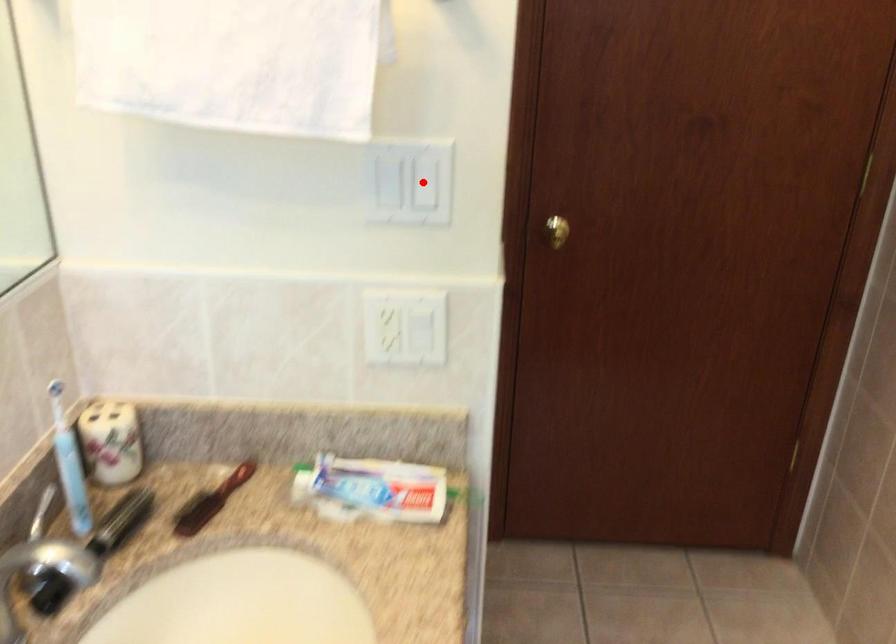
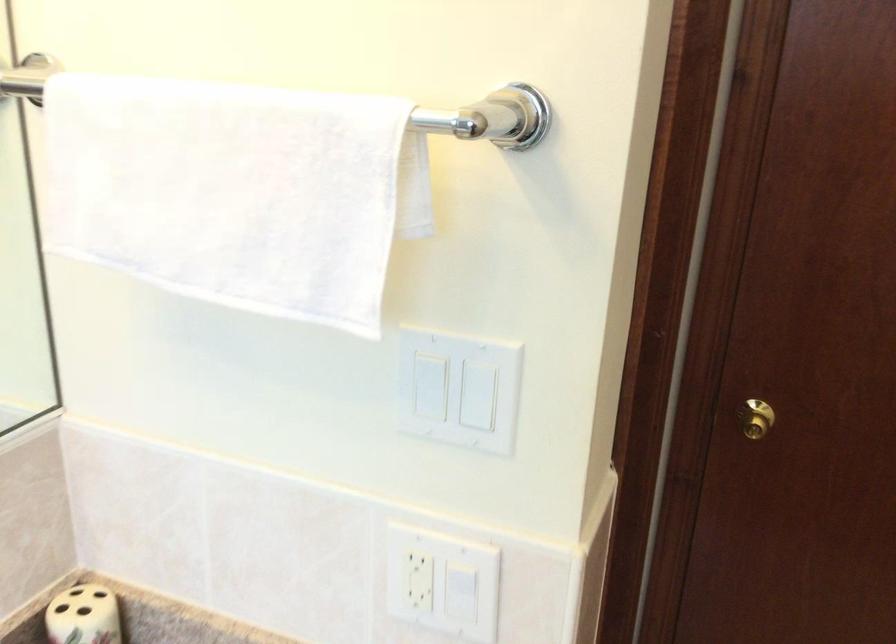
Question: I am providing you with two images of the same scene from different viewpoints. In image1, a red point is highlighted. Considering the same 3D point in image2, which of the following is correct?

Choices:
 (A) It is closer
 (B) It is farther

Answer: (A)